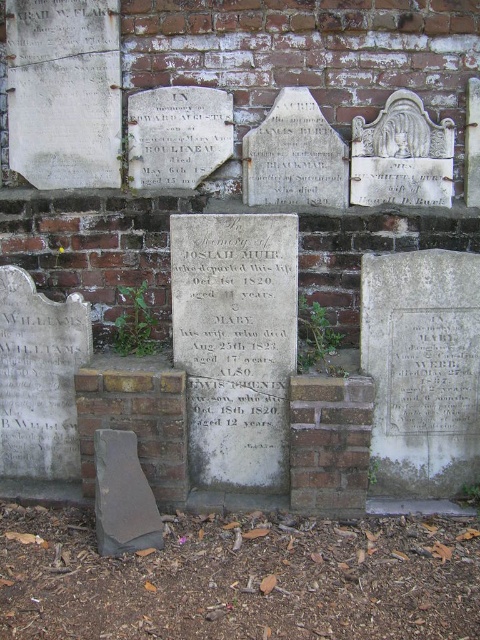
You are a historian examining the cemetery wall. You notice the gray stone plaque at center and the gray stone gravestone at lower left. Which object is positioned higher relative to the other?

The gray stone plaque at center is above the gray stone gravestone at lower left, so it is positioned higher.